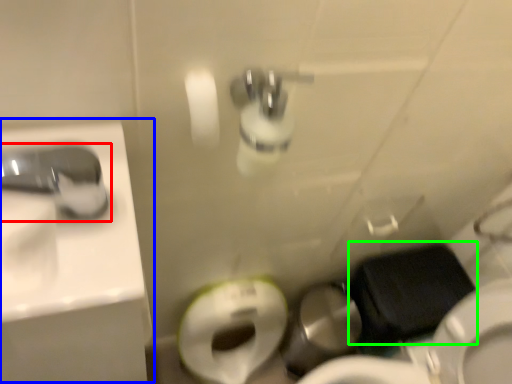
Question: Which object is positioned closest to tap (highlighted by a red box)? Select from sink (highlighted by a blue box) and sit (highlighted by a green box).

Choices:
 (A) sink
 (B) sit

Answer: (A)